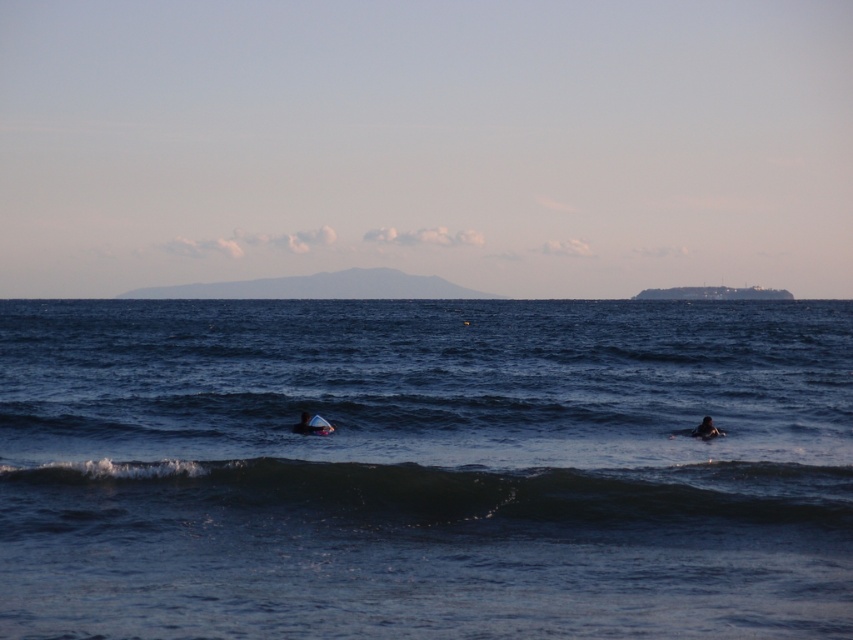
Question: Is dark blue water at lower center positioned in front of white foam surfboard at center?

Choices:
 (A) yes
 (B) no

Answer: (A)

Question: Among these points, which one is farthest from the camera?

Choices:
 (A) (556, 490)
 (B) (711, 426)
 (C) (329, 429)

Answer: (C)

Question: Estimate the real-world distances between objects in this image. Which object is closer to the dark blue water at lower center?

Choices:
 (A) dark blue wetsuit at lower right
 (B) white foam surfboard at center
 (C) blue water at center

Answer: (B)

Question: Which point appears farthest from the camera in this image?

Choices:
 (A) pyautogui.click(x=306, y=429)
 (B) pyautogui.click(x=706, y=433)
 (C) pyautogui.click(x=463, y=522)
 (D) pyautogui.click(x=700, y=424)

Answer: (D)

Question: Is white foam surfboard at center positioned behind dark blue wetsuit at lower right?

Choices:
 (A) no
 (B) yes

Answer: (B)

Question: Is blue water at center smaller than white foam surfboard at center?

Choices:
 (A) yes
 (B) no

Answer: (B)